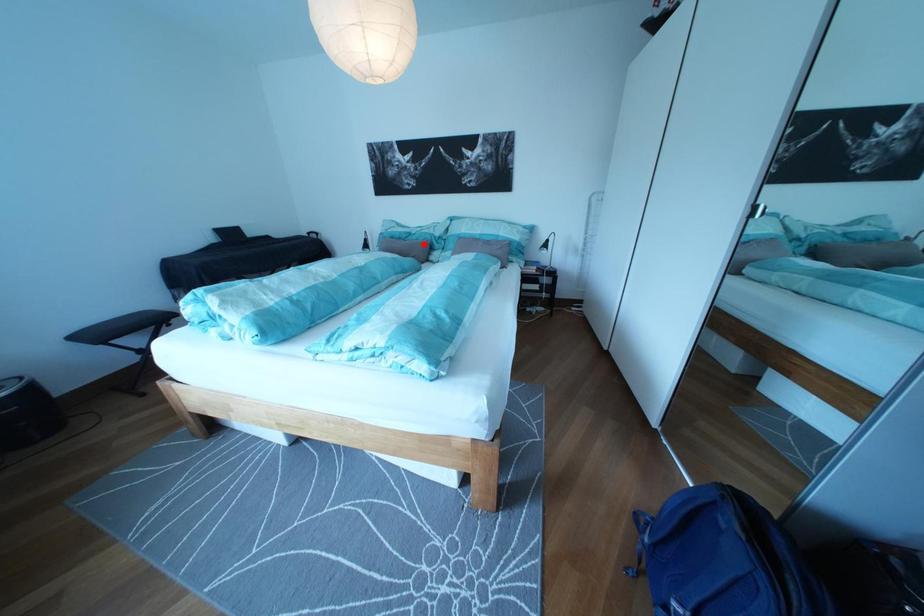
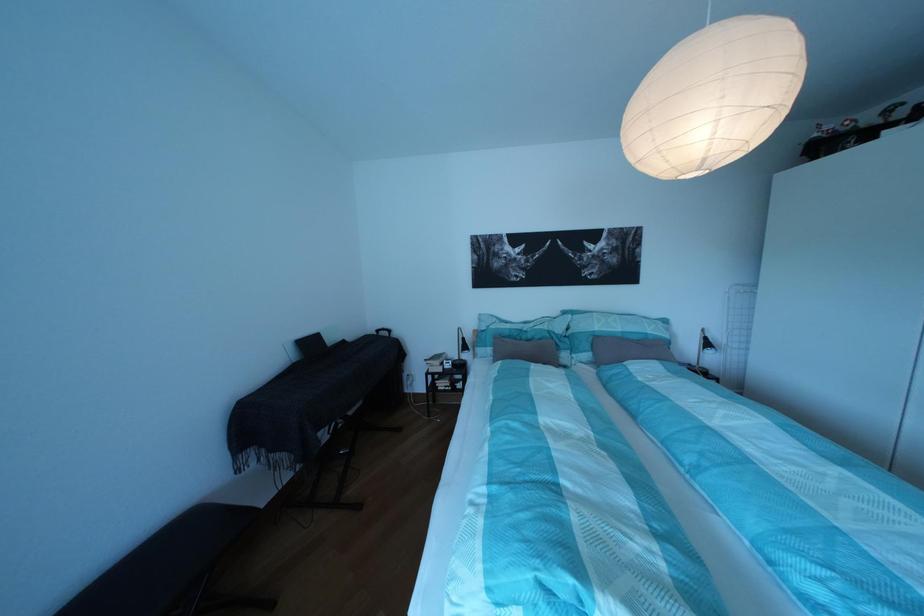
Find the pixel in the second image that matches the highlighted location in the first image.

(538, 342)